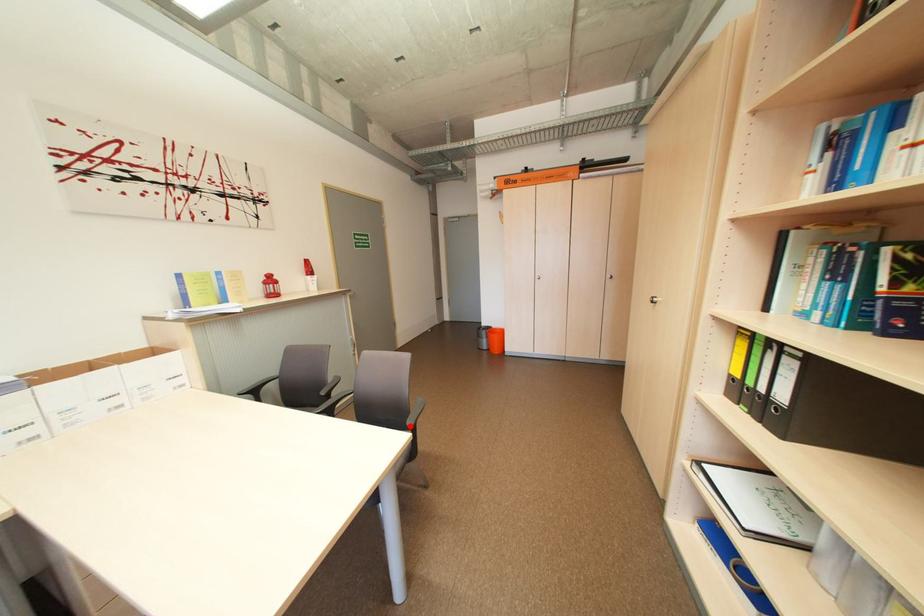
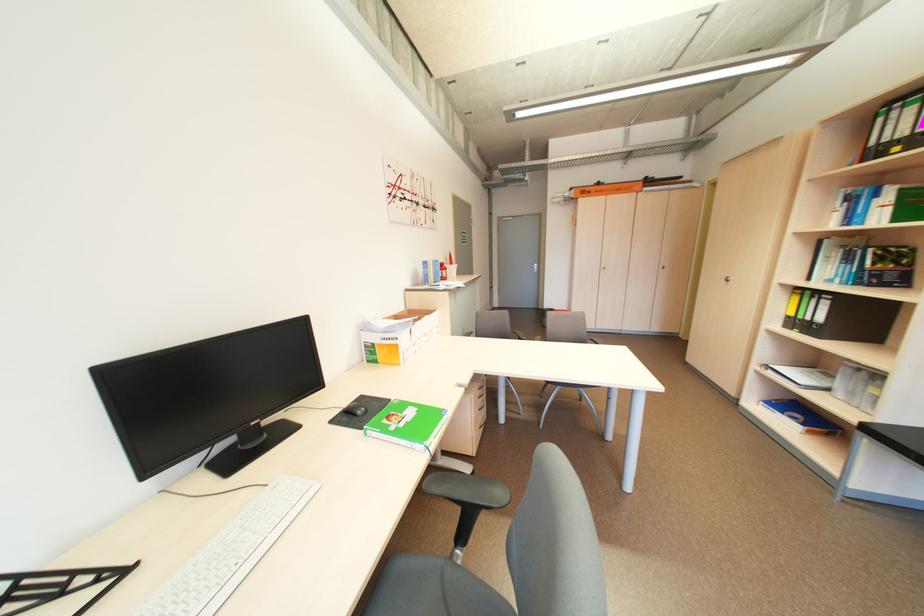
Question: I am providing you with two images of the same scene from different viewpoints. A red point is marked on the first image. Can you still see the location of the red point in image 2?

Choices:
 (A) Yes
 (B) No

Answer: (B)